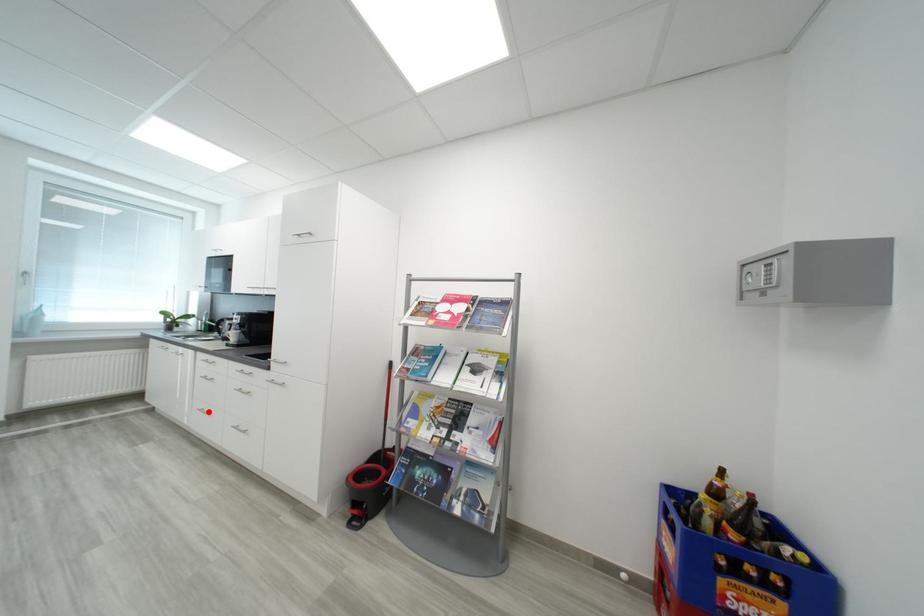
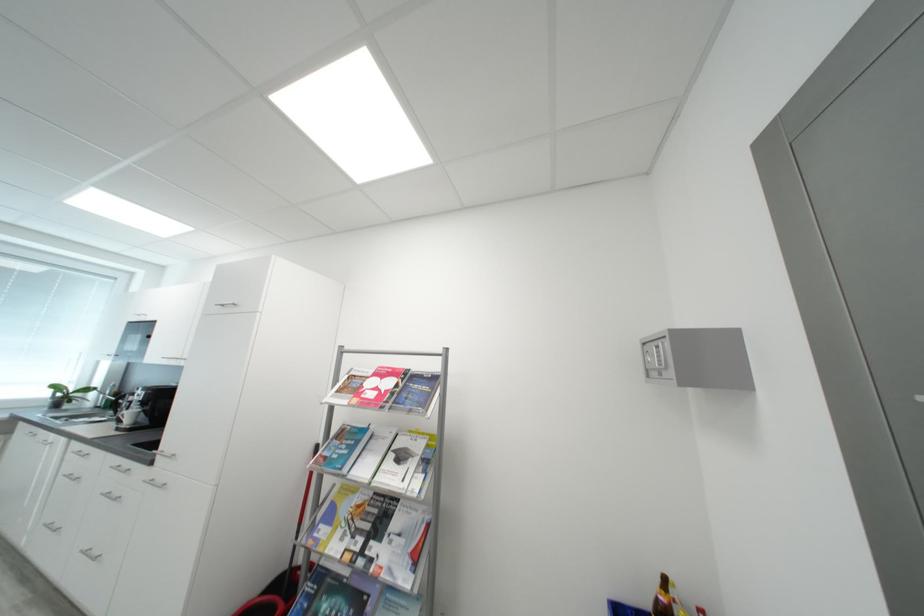
Question: I am providing you with two images of the same scene from different viewpoints. A red point is shown in image1. For the corresponding object point in image2, is it positioned nearer or farther from the camera?

Choices:
 (A) Nearer
 (B) Farther

Answer: (A)